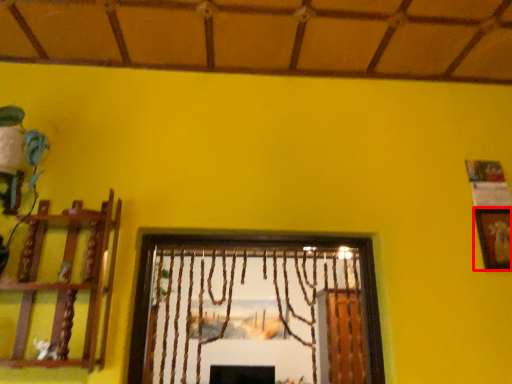
Question: Observing the image, what is the correct spatial positioning of picture frame (annotated by the red box) in reference to shelf?

Choices:
 (A) left
 (B) right

Answer: (B)